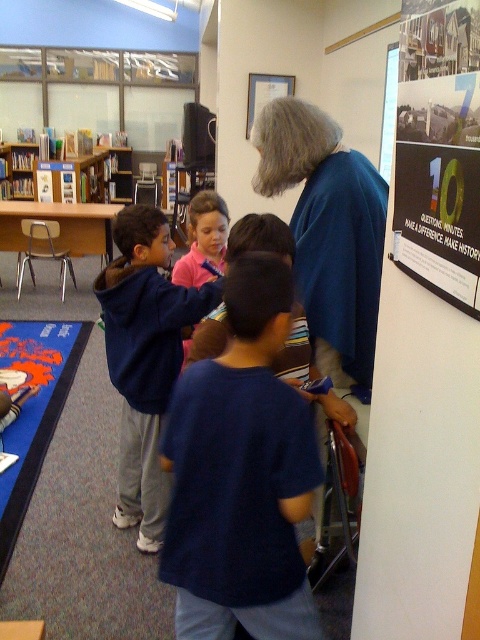
Is dark blue hoodie at center taller than wooden bookshelf at upper left?

Yes.

Can you confirm if dark blue hoodie at center is wider than wooden bookshelf at upper left?

No, dark blue hoodie at center is not wider than wooden bookshelf at upper left.

Find the location of a particular element. The width and height of the screenshot is (480, 640). dark blue hoodie at center is located at coordinates (144, 358).

Is dark blue t-shirt at center thinner than green paper poster at upper right?

In fact, dark blue t-shirt at center might be wider than green paper poster at upper right.

Is point (169, 572) behind point (442, 49)?

Yes.

Find the location of `dark blue t-shirt at center`. dark blue t-shirt at center is located at coordinates (241, 474).

Is black matte poster at upper right shorter than green paper poster at upper right?

No.

What do you see at coordinates (427, 348) in the screenshot? I see `black matte poster at upper right` at bounding box center [427, 348].

Where is `black matte poster at upper right`? The height and width of the screenshot is (640, 480). black matte poster at upper right is located at coordinates (427, 348).